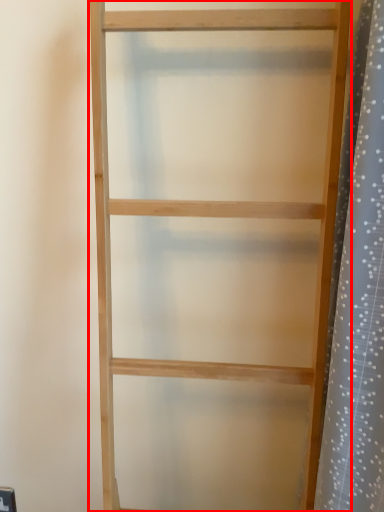
Question: From the image's perspective, what is the correct spatial relationship of shelf (annotated by the red box) in relation to shower curtain?

Choices:
 (A) above
 (B) below

Answer: (B)